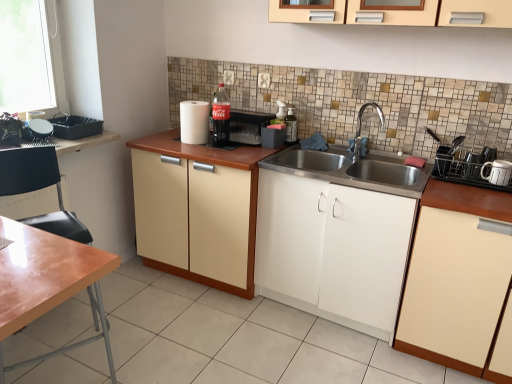
Where is `white ceramic mug at right, marked as the sixth appliance in a left-to-right arrangement`? Image resolution: width=512 pixels, height=384 pixels. white ceramic mug at right, marked as the sixth appliance in a left-to-right arrangement is located at coordinates (497, 172).

You are a GUI agent. You are given a task and a screenshot of the screen. Output one action in this format:
    pyautogui.click(x=<x>, y=<y>)
    Task: Click on the white paper towel at center, arranged as the fifth appliance when viewed from the right
    The image size is (512, 384).
    Given the screenshot: What is the action you would take?
    pyautogui.click(x=194, y=122)

What do you see at coordinates (75, 127) in the screenshot? This screenshot has width=512, height=384. I see `black plastic tray at left, which ranks as the 6th appliance in right-to-left order` at bounding box center [75, 127].

What is the approximate width of black plastic tray at left, which is the 1th appliance in left-to-right order?

black plastic tray at left, which is the 1th appliance in left-to-right order, is 10.93 inches wide.

Image resolution: width=512 pixels, height=384 pixels. Identify the location of wooden tray at left. (83, 142).

In order to click on black plastic toaster at right, the second appliance in the right-to-left sequence in this screenshot , I will do `click(471, 166)`.

How different are the orientations of matte cream cabinet at center, the 3th cabinetry when ordered from right to left, and white matte cabinet at center, the second cabinetry positioned from the left, in degrees?

The facing directions of matte cream cabinet at center, the 3th cabinetry when ordered from right to left, and white matte cabinet at center, the second cabinetry positioned from the left, are 1.53e-05 degrees apart.

Considering the relative sizes of matte cream cabinet at center, which is counted as the 1th cabinetry, starting from the left, and white matte cabinet at center, positioned as the 2th cabinetry in right-to-left order, in the image provided, is matte cream cabinet at center, which is counted as the 1th cabinetry, starting from the left, shorter than white matte cabinet at center, positioned as the 2th cabinetry in right-to-left order,?

Yes.

Who is bigger, matte cream cabinet at center, the 3th cabinetry when ordered from right to left, or white matte cabinet at center, positioned as the 2th cabinetry in right-to-left order?

With larger size is matte cream cabinet at center, the 3th cabinetry when ordered from right to left.

From a real-world perspective, is matte cream cabinet at center, the 3th cabinetry when ordered from right to left, physically located above or below white matte cabinet at center, the second cabinetry positioned from the left?

Clearly, from a real-world perspective, matte cream cabinet at center, the 3th cabinetry when ordered from right to left, is below white matte cabinet at center, the second cabinetry positioned from the left.

Is matte cream cabinet at center, which is counted as the 1th cabinetry, starting from the left, turned away from matte cream cabinet at lower right, the first cabinetry viewed from the right?

No.

From the image's perspective, which is above, matte cream cabinet at center, which is counted as the 1th cabinetry, starting from the left, or matte cream cabinet at lower right, the first cabinetry viewed from the right?

matte cream cabinet at center, which is counted as the 1th cabinetry, starting from the left, from the image's perspective.

Which is less distant, (182, 273) or (445, 329)?

Clearly, point (182, 273) is more distant from the camera than point (445, 329).

Which is correct: matte cream cabinet at center, the 3th cabinetry when ordered from right to left, is inside matte cream cabinet at lower right, acting as the 3th cabinetry starting from the left, or outside of it?

matte cream cabinet at center, the 3th cabinetry when ordered from right to left, is located beyond the bounds of matte cream cabinet at lower right, acting as the 3th cabinetry starting from the left.

Between matte cream cabinet at lower right, acting as the 3th cabinetry starting from the left, and transparent glass bottle at upper center, the 1th bottle when ordered from right to left, which one is positioned behind?

transparent glass bottle at upper center, the 1th bottle when ordered from right to left, is further away from the camera.

Between matte cream cabinet at lower right, acting as the 3th cabinetry starting from the left, and transparent glass bottle at upper center, acting as the 2th bottle starting from the left, which one has smaller width?

With smaller width is transparent glass bottle at upper center, acting as the 2th bottle starting from the left.

Considering the relative sizes of matte cream cabinet at lower right, acting as the 3th cabinetry starting from the left, and transparent glass bottle at upper center, the 1th bottle when ordered from right to left, in the image provided, is matte cream cabinet at lower right, acting as the 3th cabinetry starting from the left, smaller than transparent glass bottle at upper center, the 1th bottle when ordered from right to left,?

Incorrect, matte cream cabinet at lower right, acting as the 3th cabinetry starting from the left, is not smaller in size than transparent glass bottle at upper center, the 1th bottle when ordered from right to left.

Considering the relative sizes of matte cream cabinet at lower right, acting as the 3th cabinetry starting from the left, and transparent glass bottle at upper center, the 1th bottle when ordered from right to left, in the image provided, is matte cream cabinet at lower right, acting as the 3th cabinetry starting from the left, shorter than transparent glass bottle at upper center, the 1th bottle when ordered from right to left,?

No, matte cream cabinet at lower right, acting as the 3th cabinetry starting from the left, is not shorter than transparent glass bottle at upper center, the 1th bottle when ordered from right to left.

From their relative heights in the image, would you say silver metallic faucet at center is taller or shorter than white ceramic mug at right, marked as the sixth appliance in a left-to-right arrangement?

In the image, silver metallic faucet at center appears to be taller than white ceramic mug at right, marked as the sixth appliance in a left-to-right arrangement.

From a real-world perspective, which appliance is the 5th one underneath the silver metallic faucet at center? Please provide its 2D coordinates.

[(497, 172)]

Considering the sizes of objects silver metallic faucet at center and white ceramic mug at right, the first appliance when ordered from right to left, in the image provided, who is thinner, silver metallic faucet at center or white ceramic mug at right, the first appliance when ordered from right to left,?

With smaller width is white ceramic mug at right, the first appliance when ordered from right to left.

Based on the photo, from the image's perspective, relative to white ceramic mug at right, marked as the sixth appliance in a left-to-right arrangement, is silver metallic faucet at center above or below?

silver metallic faucet at center is above white ceramic mug at right, marked as the sixth appliance in a left-to-right arrangement.

How many degrees apart are the facing directions of matte cream cabinet at lower right, acting as the 3th cabinetry starting from the left, and black plastic tray at left, which is the 1th appliance in left-to-right order?

matte cream cabinet at lower right, acting as the 3th cabinetry starting from the left, and black plastic tray at left, which is the 1th appliance in left-to-right order, are facing 9.11e-05 degrees away from each other.

Considering the sizes of objects matte cream cabinet at lower right, the first cabinetry viewed from the right, and black plastic tray at left, which ranks as the 6th appliance in right-to-left order, in the image provided, who is shorter, matte cream cabinet at lower right, the first cabinetry viewed from the right, or black plastic tray at left, which ranks as the 6th appliance in right-to-left order,?

black plastic tray at left, which ranks as the 6th appliance in right-to-left order, is shorter.

From the image's perspective, does matte cream cabinet at lower right, the first cabinetry viewed from the right, appear higher than black plastic tray at left, which ranks as the 6th appliance in right-to-left order?

No, from the image's perspective, matte cream cabinet at lower right, the first cabinetry viewed from the right, is not over black plastic tray at left, which ranks as the 6th appliance in right-to-left order.

Considering the relative sizes of matte cream cabinet at lower right, acting as the 3th cabinetry starting from the left, and black plastic tray at left, which is the 1th appliance in left-to-right order, in the image provided, is matte cream cabinet at lower right, acting as the 3th cabinetry starting from the left, wider than black plastic tray at left, which is the 1th appliance in left-to-right order,?

Correct, the width of matte cream cabinet at lower right, acting as the 3th cabinetry starting from the left, exceeds that of black plastic tray at left, which is the 1th appliance in left-to-right order.

Which object is closer to the camera taking this photo, transparent glass bottle at upper center, acting as the 2th bottle starting from the left, or black plastic tray at left, which ranks as the 6th appliance in right-to-left order?

black plastic tray at left, which ranks as the 6th appliance in right-to-left order, is more forward.

Consider the image. Which of these two, transparent glass bottle at upper center, the 1th bottle when ordered from right to left, or black plastic tray at left, which is the 1th appliance in left-to-right order, stands shorter?

black plastic tray at left, which is the 1th appliance in left-to-right order.

Is black plastic tray at left, which ranks as the 6th appliance in right-to-left order, at the back of transparent glass bottle at upper center, the 1th bottle when ordered from right to left?

transparent glass bottle at upper center, the 1th bottle when ordered from right to left, does not have its back to black plastic tray at left, which ranks as the 6th appliance in right-to-left order.

From a real-world perspective, relative to black plastic tray at left, which ranks as the 6th appliance in right-to-left order, is wooden tray at left vertically above or below?

Clearly, from a real-world perspective, wooden tray at left is below black plastic tray at left, which ranks as the 6th appliance in right-to-left order.

From the picture: Relative to black plastic tray at left, which ranks as the 6th appliance in right-to-left order, is wooden tray at left in front or behind?

Visually, wooden tray at left is located in front of black plastic tray at left, which ranks as the 6th appliance in right-to-left order.

Does wooden tray at left turn towards black plastic tray at left, which is the 1th appliance in left-to-right order?

No, wooden tray at left does not turn towards black plastic tray at left, which is the 1th appliance in left-to-right order.

Based on the photo, measure the distance between wooden tray at left and black plastic tray at left, which ranks as the 6th appliance in right-to-left order.

wooden tray at left is 3.64 inches from black plastic tray at left, which ranks as the 6th appliance in right-to-left order.

Which cabinetry is the 1st one when counting from the front of the matte cream cabinet at center, which is counted as the 1th cabinetry, starting from the left? Please provide its 2D coordinates.

[(333, 250)]

Starting from the matte cream cabinet at lower right, acting as the 3th cabinetry starting from the left, which cabinetry is the 2nd one to the left? Please provide its 2D coordinates.

[(196, 220)]

Based on their spatial positions, is black plastic tray at left, which is the 1th appliance in left-to-right order, or matte plastic container at center, arranged as the 3th appliance when viewed from the right, further from transparent glass bottle at upper center, acting as the 2th bottle starting from the left?

black plastic tray at left, which is the 1th appliance in left-to-right order, lies further to transparent glass bottle at upper center, acting as the 2th bottle starting from the left, than the other object.

Which object lies nearer to the anchor point matte plastic soda machine at center, the third appliance in the left-to-right sequence, black plastic toaster at right, the 5th appliance from the left, or silver metallic faucet at center?

silver metallic faucet at center is closer to matte plastic soda machine at center, the third appliance in the left-to-right sequence.

Looking at this image, which object lies further to the anchor point matte glass bottle at center, placed as the second bottle when sorted from right to left, silver metallic faucet at center or matte plastic container at center, arranged as the 3th appliance when viewed from the right?

silver metallic faucet at center.

Which object lies nearer to the anchor point silver metallic faucet at center, white matte cabinet at center, the second cabinetry positioned from the left, or white paper towel at center, which is the second appliance in left-to-right order?

white matte cabinet at center, the second cabinetry positioned from the left, is closer to silver metallic faucet at center.

Based on their spatial positions, is matte cream cabinet at center, which is counted as the 1th cabinetry, starting from the left, or matte plastic container at center, the 4th appliance in the left-to-right sequence, further from black plastic toaster at right, the second appliance in the right-to-left sequence?

matte cream cabinet at center, which is counted as the 1th cabinetry, starting from the left.

From the image, which object appears to be nearer to matte cream cabinet at lower right, the first cabinetry viewed from the right, wooden tray at left or white paper towel at center, arranged as the fifth appliance when viewed from the right?

The object closer to matte cream cabinet at lower right, the first cabinetry viewed from the right, is white paper towel at center, arranged as the fifth appliance when viewed from the right.

When comparing their distances from white matte cabinet at center, positioned as the 2th cabinetry in right-to-left order, does wooden tray at left or matte cream cabinet at lower right, acting as the 3th cabinetry starting from the left, seem further?

Among the two, wooden tray at left is located further to white matte cabinet at center, positioned as the 2th cabinetry in right-to-left order.

Considering their positions, is matte cream cabinet at lower right, the first cabinetry viewed from the right, positioned further to white matte cabinet at center, positioned as the 2th cabinetry in right-to-left order, than matte plastic soda machine at center, the third appliance in the left-to-right sequence?

matte plastic soda machine at center, the third appliance in the left-to-right sequence.

I want to click on cabinetry located between black plastic tray at left, which ranks as the 6th appliance in right-to-left order, and matte plastic soda machine at center, the third appliance in the left-to-right sequence, in the left-right direction, so click(x=196, y=220).

At what (x,y) coordinates should I click in order to perform the action: click on tap located between white matte cabinet at center, positioned as the 2th cabinetry in right-to-left order, and white ceramic mug at right, the first appliance when ordered from right to left, in the left-right direction. Please return your answer as a coordinate pair (x, y). The image size is (512, 384). Looking at the image, I should click on (360, 128).

This screenshot has height=384, width=512. Identify the location of bottle between matte plastic soda machine at center, positioned as the fourth appliance in right-to-left order, and silver metallic faucet at center from left to right. (291, 127).

What are the coordinates of `tap between matte glass bottle at center, placed as the second bottle when sorted from right to left, and matte cream cabinet at lower right, the first cabinetry viewed from the right` in the screenshot? It's located at (360, 128).